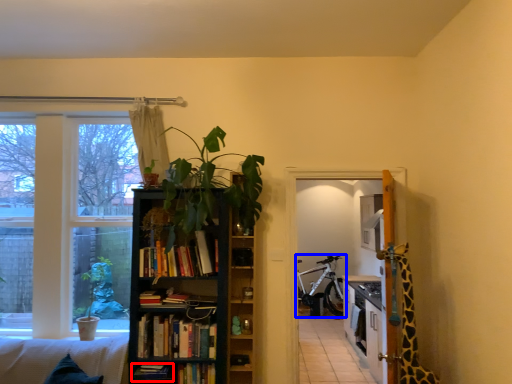
Question: Which of the following is the closest to the observer, book (highlighted by a red box) or bicycle (highlighted by a blue box)?

Choices:
 (A) book
 (B) bicycle

Answer: (A)